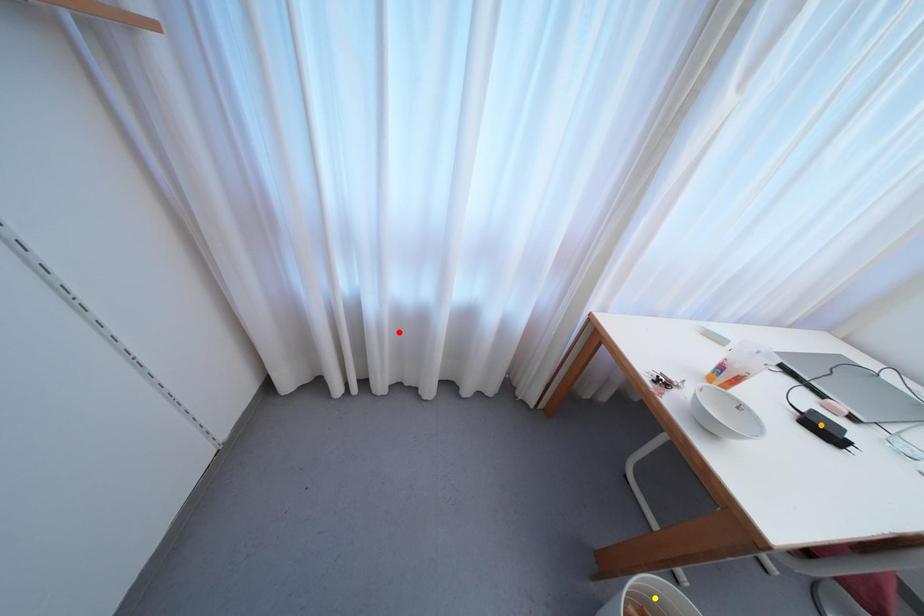
Order these from nearest to farthest:
A) red point
B) orange point
C) yellow point

orange point < yellow point < red point